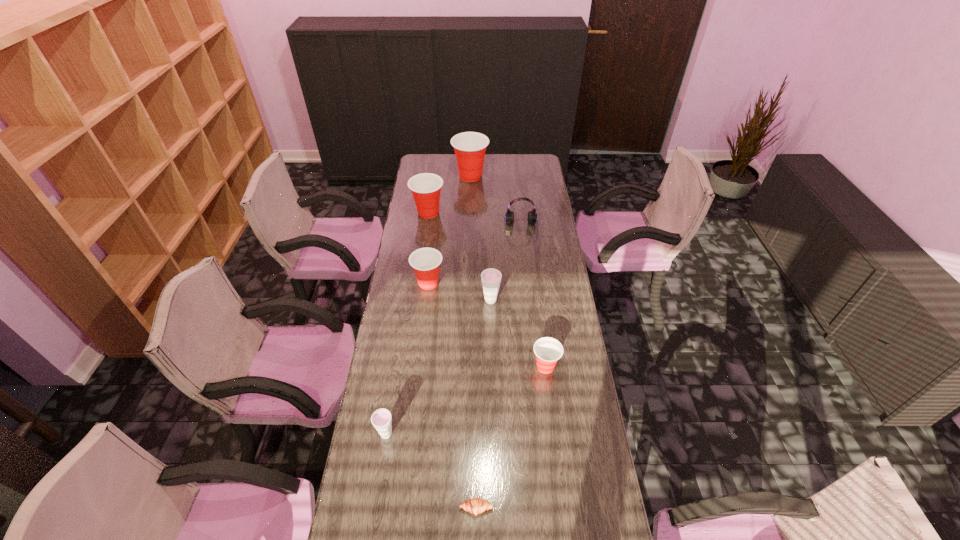
I want to click on red cup that is the second closest to the right purple cup, so click(x=548, y=350).

This screenshot has height=540, width=960. In order to click on free space in the image that satisfies the following two spatial constraints: 1. on the back side of the second nearest red cup; 2. on the right side of the smaller purple cup in this screenshot , I will do `click(410, 283)`.